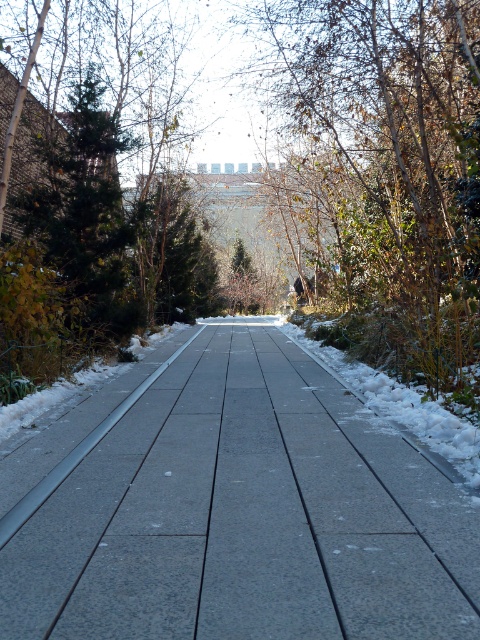
You are a delivery person trying to navigate through the snow in the winter scene. You see the gray concrete pavement at center and the brown leafy tree at center. Which object is more likely to be covered by snow?

The gray concrete pavement at center is smaller than the brown leafy tree at center, so the pavement is more likely to be fully covered by snow since it has a smaller surface area compared to the tree.

You are standing at the starting point of the pathway and want to walk straight to the building in the distance. According to the coordinates provided, where should you aim your direction to ensure you stay on the gray concrete pavement at center?

→ You should aim your direction towards the coordinates point at (232, 509) where the gray concrete pavement at center is located to stay on the path.

In the scene shown: You are standing at the start of the gray concrete pavement at center and want to walk towards the building in the background. There is a brown leafy tree at center blocking your path. Can you walk around it on either side? Please explain using the objects mentioned.

The gray concrete pavement at center has a lesser height compared to brown leafy tree at center. Since the pavement is lower than the tree, you can walk around the tree on either side along the pavement since the tree is at the center and the path is wide enough to go around it.